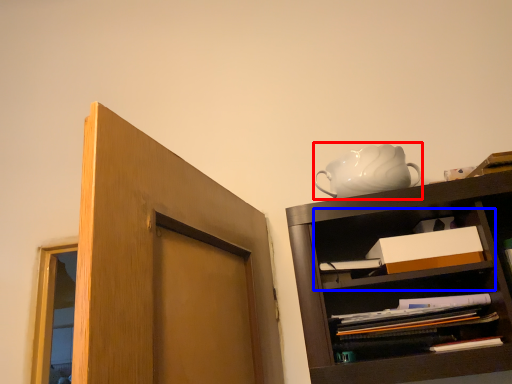
Question: Which object appears farthest to the camera in this image, tea pot (highlighted by a red box) or cabinet (highlighted by a blue box)?

Choices:
 (A) tea pot
 (B) cabinet

Answer: (A)